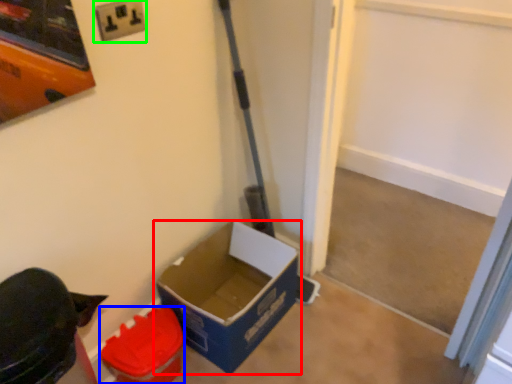
Question: Which object is the closest to the box (highlighted by a red box)? Choose among these: box (highlighted by a blue box) or electric outlet (highlighted by a green box).

Choices:
 (A) box
 (B) electric outlet

Answer: (A)